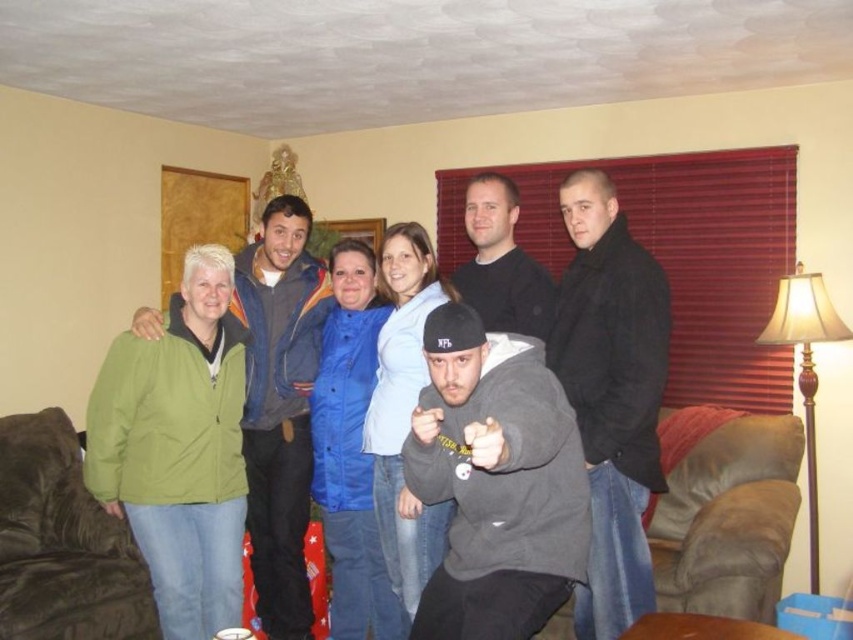
You are standing in the living room and want to find the gray matte hoodie at center. Based on the coordinates provided, which object in the scene is located at point (x=495, y=481)?

The gray matte hoodie at center is located at point (x=495, y=481).

You are a photographer trying to capture a group photo. You want to ensure that the gray matte hoodie at center and the green matte jacket at left are close enough to appear in the same frame. The minimum distance required for your camera to focus on both subjects simultaneously is 30 inches. Can both subjects be captured clearly in the same frame?

The gray matte hoodie at center and green matte jacket at left are 31.29 inches apart from each other. Since the required minimum distance is 30 inches, the 31.29 inches exceeds this threshold, so the camera may not be able to focus on both subjects simultaneously. Adjust their positions to be closer or use a different camera setting.